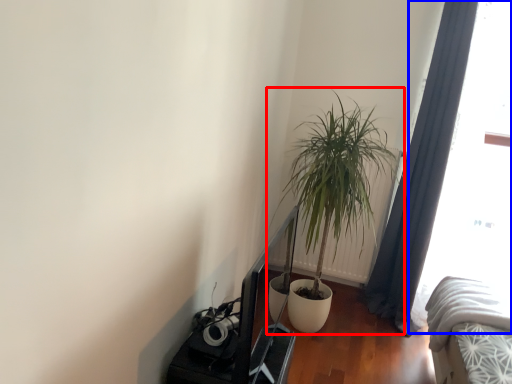
Question: Which of the following is the closest to the observer, houseplant (highlighted by a red box) or window screen (highlighted by a blue box)?

Choices:
 (A) houseplant
 (B) window screen

Answer: (A)